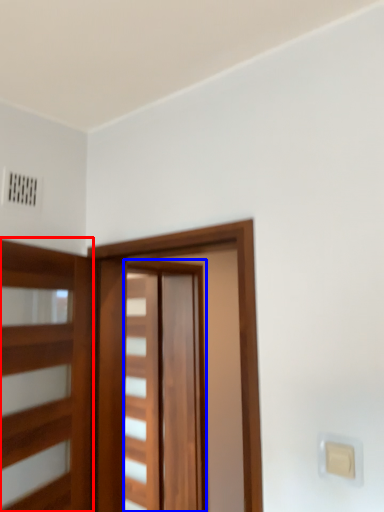
Question: Which object appears farthest to the camera in this image, elevator (highlighted by a red box) or barn door (highlighted by a blue box)?

Choices:
 (A) elevator
 (B) barn door

Answer: (B)